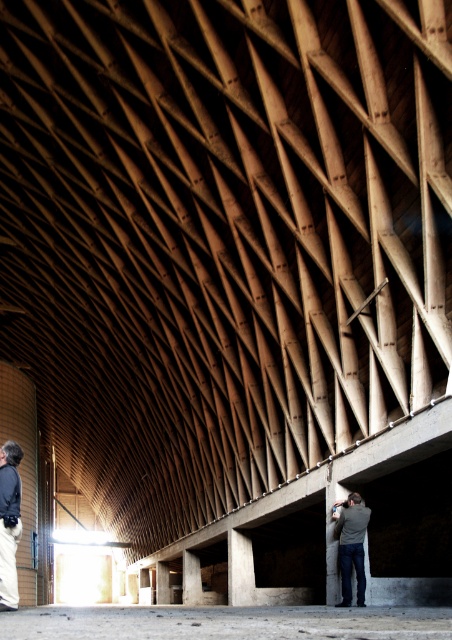
Who is lower down, dark gray jacket at lower left or gray fabric jacket at lower center?

gray fabric jacket at lower center

Who is positioned more to the left, dark gray jacket at lower left or gray fabric jacket at lower center?

dark gray jacket at lower left

Find the location of a particular element. The height and width of the screenshot is (640, 452). dark gray jacket at lower left is located at coordinates (9, 522).